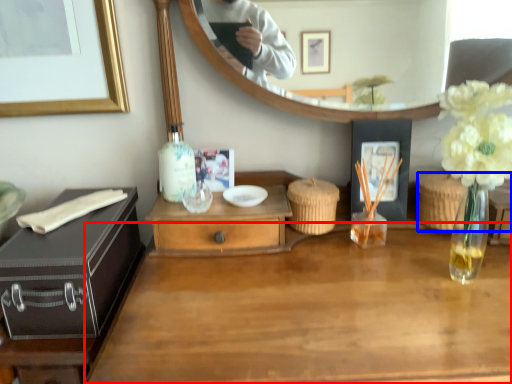
Question: Which object is further to the camera taking this photo, desk (highlighted by a red box) or picnic basket (highlighted by a blue box)?

Choices:
 (A) desk
 (B) picnic basket

Answer: (B)